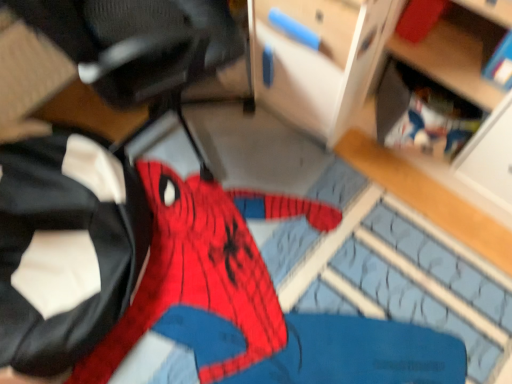
This screenshot has height=384, width=512. Describe the element at coordinates (422, 113) in the screenshot. I see `wooden bookshelf at upper right, which is counted as the second shelf, starting from the front` at that location.

At what (x,y) coordinates should I click in order to perform the action: click on red fabric spider-man costume at left. Please return your answer as a coordinate pair (x, y). The image size is (512, 384). Looking at the image, I should click on (66, 248).

Is wooden bookshelf at upper right, arranged as the first shelf when viewed from the back, bigger than wooden shelf at lower right, which is the second shelf from back to front?

Incorrect, wooden bookshelf at upper right, arranged as the first shelf when viewed from the back, is not larger than wooden shelf at lower right, which is the second shelf from back to front.

Does wooden bookshelf at upper right, which is counted as the second shelf, starting from the front, have a greater height compared to wooden shelf at lower right, which is the second shelf from back to front?

No.

Could you tell me if wooden bookshelf at upper right, which is counted as the second shelf, starting from the front, is turned towards wooden shelf at lower right, which ranks as the 1th shelf in front-to-back order?

Yes, wooden bookshelf at upper right, which is counted as the second shelf, starting from the front, is facing wooden shelf at lower right, which ranks as the 1th shelf in front-to-back order.

Between wooden bookshelf at upper right, which is counted as the second shelf, starting from the front, and wooden shelf at lower right, which is the second shelf from back to front, which one appears on the left side from the viewer's perspective?

wooden bookshelf at upper right, which is counted as the second shelf, starting from the front, is more to the left.

This screenshot has height=384, width=512. In order to click on the 2nd shelf to the right of the red fabric spider-man costume at left, starting your count from the anchor in this screenshot , I will do `click(454, 108)`.

Is wooden shelf at lower right, which is the second shelf from back to front, oriented away from red fabric spider-man costume at left?

That's not correct — wooden shelf at lower right, which is the second shelf from back to front, is not looking away from red fabric spider-man costume at left.

Between wooden shelf at lower right, which is the second shelf from back to front, and red fabric spider-man costume at left, which one is positioned in front?

wooden shelf at lower right, which is the second shelf from back to front.

From the image's perspective, which is below, wooden bookshelf at upper right, arranged as the first shelf when viewed from the back, or red fabric spider-man costume at left?

red fabric spider-man costume at left is shown below in the image.

The width and height of the screenshot is (512, 384). What are the coordinates of `clothing beneath the wooden bookshelf at upper right, which is counted as the second shelf, starting from the front (from a real-world perspective)` in the screenshot? It's located at (66, 248).

Between wooden bookshelf at upper right, arranged as the first shelf when viewed from the back, and red fabric spider-man costume at left, which one appears on the left side from the viewer's perspective?

red fabric spider-man costume at left is more to the left.

How different are the orientations of wooden bookshelf at upper right, arranged as the first shelf when viewed from the back, and red fabric spider-man costume at left in degrees?

91.5 degrees.

Is red fabric spider-man costume at left at the right side of wooden shelf at lower right, which is the second shelf from back to front?

No, red fabric spider-man costume at left is not to the right of wooden shelf at lower right, which is the second shelf from back to front.

Between red fabric spider-man costume at left and wooden shelf at lower right, which is the second shelf from back to front, which one has larger width?

Wider between the two is red fabric spider-man costume at left.

From a real-world perspective, is red fabric spider-man costume at left positioned above or below wooden shelf at lower right, which is the second shelf from back to front?

From a real-world perspective, red fabric spider-man costume at left is physically below wooden shelf at lower right, which is the second shelf from back to front.

Is red fabric spider-man costume at left aimed at wooden shelf at lower right, which is the second shelf from back to front?

No, red fabric spider-man costume at left is not aimed at wooden shelf at lower right, which is the second shelf from back to front.

From the picture: Between red fabric spider-man costume at left and wooden bookshelf at upper right, which is counted as the second shelf, starting from the front, which one appears on the right side from the viewer's perspective?

wooden bookshelf at upper right, which is counted as the second shelf, starting from the front.

Considering the sizes of objects red fabric spider-man costume at left and wooden bookshelf at upper right, which is counted as the second shelf, starting from the front, in the image provided, who is smaller, red fabric spider-man costume at left or wooden bookshelf at upper right, which is counted as the second shelf, starting from the front,?

With smaller size is wooden bookshelf at upper right, which is counted as the second shelf, starting from the front.

In the scene shown: Is red fabric spider-man costume at left in front of or behind wooden bookshelf at upper right, arranged as the first shelf when viewed from the back, in the image?

red fabric spider-man costume at left is positioned closer to the viewer than wooden bookshelf at upper right, arranged as the first shelf when viewed from the back.

Between red fabric spider-man costume at left and wooden bookshelf at upper right, arranged as the first shelf when viewed from the back, which one has smaller width?

wooden bookshelf at upper right, arranged as the first shelf when viewed from the back.

Locate an element on the screen. This screenshot has width=512, height=384. shelf that is behind the wooden shelf at lower right, which ranks as the 1th shelf in front-to-back order is located at coordinates (422, 113).

Would you say wooden shelf at lower right, which is the second shelf from back to front, is outside wooden bookshelf at upper right, arranged as the first shelf when viewed from the back?

Yes, wooden shelf at lower right, which is the second shelf from back to front, is outside of wooden bookshelf at upper right, arranged as the first shelf when viewed from the back.

Considering the relative sizes of wooden shelf at lower right, which ranks as the 1th shelf in front-to-back order, and wooden bookshelf at upper right, which is counted as the second shelf, starting from the front, in the image provided, is wooden shelf at lower right, which ranks as the 1th shelf in front-to-back order, taller than wooden bookshelf at upper right, which is counted as the second shelf, starting from the front,?

Correct, wooden shelf at lower right, which ranks as the 1th shelf in front-to-back order, is much taller as wooden bookshelf at upper right, which is counted as the second shelf, starting from the front.

Identify the location of shelf above the wooden bookshelf at upper right, arranged as the first shelf when viewed from the back (from a real-world perspective). (454, 108).

Identify the location of shelf that is in front of the red fabric spider-man costume at left. (454, 108).

Consider the image. Considering their positions, is wooden shelf at lower right, which is the second shelf from back to front, positioned further to red fabric spider-man costume at left than wooden bookshelf at upper right, arranged as the first shelf when viewed from the back?

The object further to red fabric spider-man costume at left is wooden shelf at lower right, which is the second shelf from back to front.

Which object lies further to the anchor point wooden bookshelf at upper right, arranged as the first shelf when viewed from the back, red fabric spider-man costume at left or wooden shelf at lower right, which ranks as the 1th shelf in front-to-back order?

The object further to wooden bookshelf at upper right, arranged as the first shelf when viewed from the back, is red fabric spider-man costume at left.

Estimate the real-world distances between objects in this image. Which object is further from wooden bookshelf at upper right, which is counted as the second shelf, starting from the front, wooden shelf at lower right, which ranks as the 1th shelf in front-to-back order, or red fabric spider-man costume at left?

red fabric spider-man costume at left.

Considering their positions, is wooden bookshelf at upper right, arranged as the first shelf when viewed from the back, positioned further to wooden shelf at lower right, which is the second shelf from back to front, than red fabric spider-man costume at left?

Among the two, red fabric spider-man costume at left is located further to wooden shelf at lower right, which is the second shelf from back to front.

Estimate the real-world distances between objects in this image. Which object is further from wooden shelf at lower right, which ranks as the 1th shelf in front-to-back order, red fabric spider-man costume at left or wooden bookshelf at upper right, arranged as the first shelf when viewed from the back?

red fabric spider-man costume at left is positioned further to the anchor wooden shelf at lower right, which ranks as the 1th shelf in front-to-back order.

Looking at the image, which one is located further to red fabric spider-man costume at left, wooden bookshelf at upper right, which is counted as the second shelf, starting from the front, or wooden shelf at lower right, which ranks as the 1th shelf in front-to-back order?

wooden shelf at lower right, which ranks as the 1th shelf in front-to-back order.

Where is `shelf between red fabric spider-man costume at left and wooden shelf at lower right, which ranks as the 1th shelf in front-to-back order, from left to right`? shelf between red fabric spider-man costume at left and wooden shelf at lower right, which ranks as the 1th shelf in front-to-back order, from left to right is located at coordinates (422, 113).